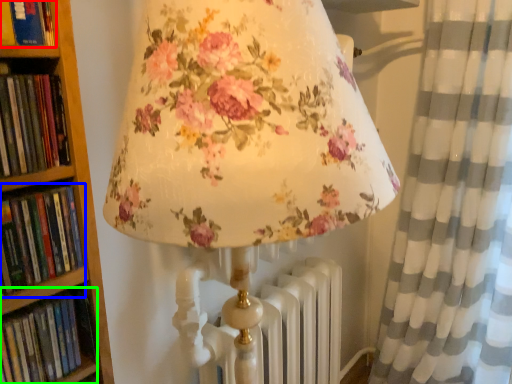
Question: Which is nearer to the book (highlighted by a red box)? book (highlighted by a blue box) or book (highlighted by a green box).

Choices:
 (A) book
 (B) book

Answer: (A)